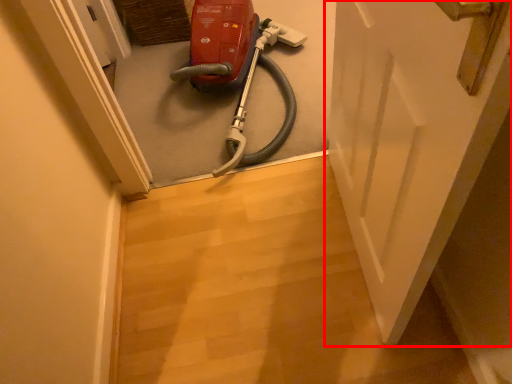
Question: Considering the relative positions of door (annotated by the red box) and equipment in the image provided, where is door (annotated by the red box) located with respect to the staircase?

Choices:
 (A) right
 (B) left

Answer: (A)